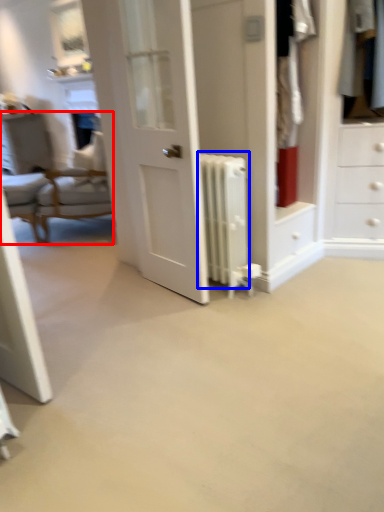
Question: Among these objects, which one is farthest to the camera, chair (highlighted by a red box) or radiator (highlighted by a blue box)?

Choices:
 (A) chair
 (B) radiator

Answer: (A)